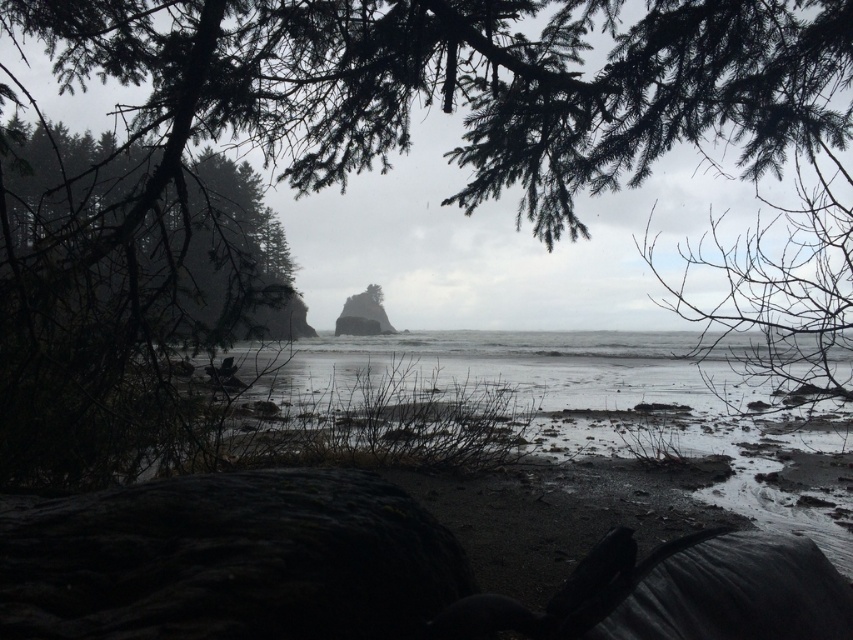
In the scene shown: Does gray matte water at center have a lesser height compared to dark green textured tree at left?

Indeed, gray matte water at center has a lesser height compared to dark green textured tree at left.

Does gray matte water at center appear on the right side of dark green textured tree at left?

Indeed, gray matte water at center is positioned on the right side of dark green textured tree at left.

Describe the element at coordinates (537, 392) in the screenshot. I see `gray matte water at center` at that location.

At what (x,y) coordinates should I click in order to perform the action: click on gray matte water at center. Please return your answer as a coordinate pair (x, y). The height and width of the screenshot is (640, 853). Looking at the image, I should click on (537, 392).